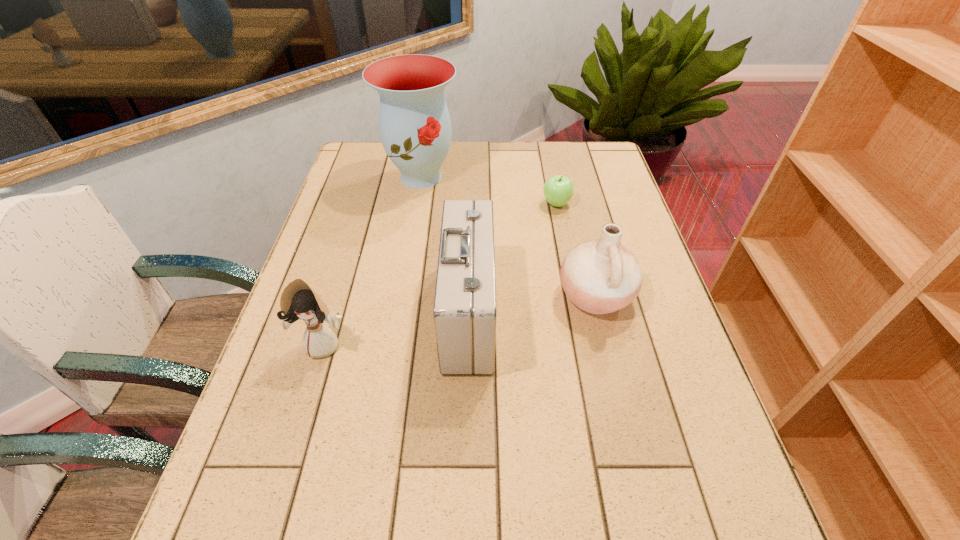
At what (x,y) coordinates should I click in order to perform the action: click on free spot that satisfies the following two spatial constraints: 1. on the front-facing side of the first-aid kit; 2. at the front face of the doll. Please return your answer as a coordinate pair (x, y). Looking at the image, I should click on (468, 344).

Find the location of a particular element. The width and height of the screenshot is (960, 540). free point that satisfies the following two spatial constraints: 1. to pour from the handle of the pottery; 2. at the front face of the doll is located at coordinates (607, 344).